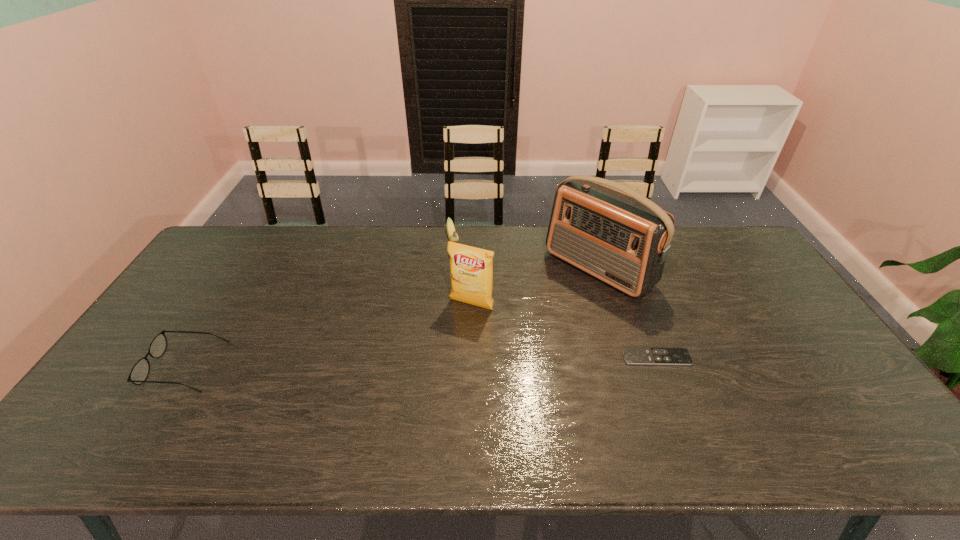
Image resolution: width=960 pixels, height=540 pixels. I want to click on the leftmost object, so click(140, 371).

Identify the location of the fourth tallest object. 140,371.

Locate an element on the screen. The image size is (960, 540). remote control is located at coordinates (632, 355).

At what (x,y) coordinates should I click in order to perform the action: click on the fourth shortest object. Please return your answer as a coordinate pair (x, y). Looking at the image, I should click on (471, 268).

Identify the location of the tallest object. (623, 239).

The width and height of the screenshot is (960, 540). What are the coordinates of `banana` in the screenshot? It's located at (452, 234).

Where is `free space located on the front-facing side of the leftmost object`? This screenshot has height=540, width=960. free space located on the front-facing side of the leftmost object is located at coordinates (135, 366).

You are a GUI agent. You are given a task and a screenshot of the screen. Output one action in this format:
    pyautogui.click(x=<x>, y=<y>)
    Task: Click on the free space located on the right of the shortest object
    This screenshot has width=960, height=540.
    Given the screenshot: What is the action you would take?
    pyautogui.click(x=737, y=357)

Where is `vacant space located on the front of the crisp (potato chip) with the logo`? This screenshot has height=540, width=960. vacant space located on the front of the crisp (potato chip) with the logo is located at coordinates (420, 387).

The width and height of the screenshot is (960, 540). Find the location of `vacant region located on the front of the crisp (potato chip) with the logo`. vacant region located on the front of the crisp (potato chip) with the logo is located at coordinates (454, 330).